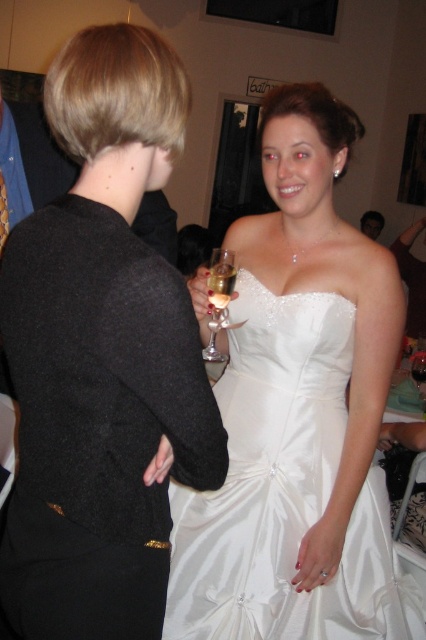
What do you see at coordinates (218, 298) in the screenshot?
I see `clear glass wine glass at center` at bounding box center [218, 298].

Does point (224, 289) lie behind point (209, 305)?

That is True.

Is point (219, 298) farther from viewer compared to point (210, 300)?

That is False.

Locate an element on the screen. The height and width of the screenshot is (640, 426). clear glass wine glass at center is located at coordinates (218, 298).

Is satin white dress at center to the left of transparent glass at center from the viewer's perspective?

Yes, satin white dress at center is to the left of transparent glass at center.

Does satin white dress at center appear over transparent glass at center?

Correct, satin white dress at center is located above transparent glass at center.

Who is more distant from viewer, (244, 612) or (414, 378)?

Positioned behind is point (414, 378).

Find the location of a particular element. The image size is (426, 640). satin white dress at center is located at coordinates [x=299, y=413].

Can you confirm if clear glass wine glass at center is positioned to the left of matte black hair at upper center?

Yes, clear glass wine glass at center is to the left of matte black hair at upper center.

Between clear glass wine glass at center and matte black hair at upper center, which one appears on the right side from the viewer's perspective?

matte black hair at upper center

Is point (221, 294) positioned before point (371, 237)?

Yes.

The width and height of the screenshot is (426, 640). I want to click on clear glass wine glass at center, so click(x=218, y=298).